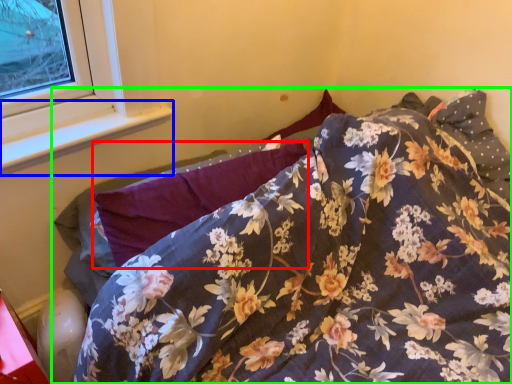
Question: Estimate the real-world distances between objects in this image. Which object is farther from pillow (highlighted by a red box), window sill (highlighted by a blue box) or bed (highlighted by a green box)?

Choices:
 (A) window sill
 (B) bed

Answer: (A)